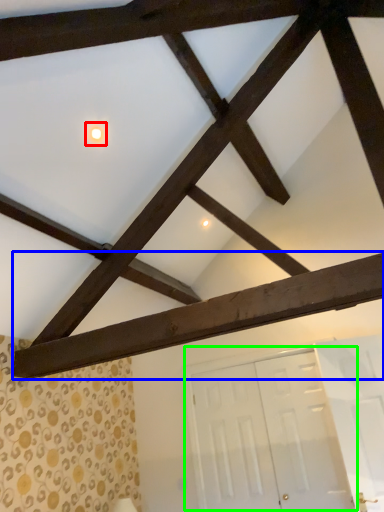
Question: Which object is positioned closest to light (highlighted by a red box)? Select from plank (highlighted by a blue box) and door (highlighted by a green box).

Choices:
 (A) plank
 (B) door

Answer: (A)